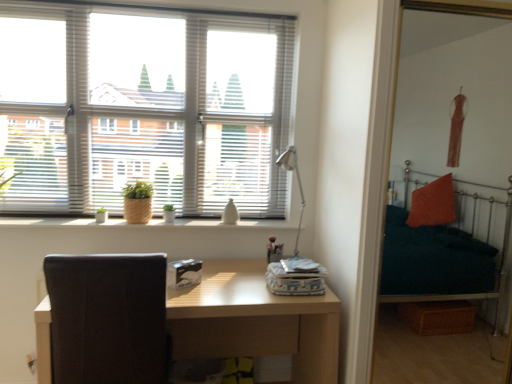
Where is `vacant space underneath braided straw pot at window (from a real-world perspective)`? This screenshot has height=384, width=512. vacant space underneath braided straw pot at window (from a real-world perspective) is located at coordinates (137, 217).